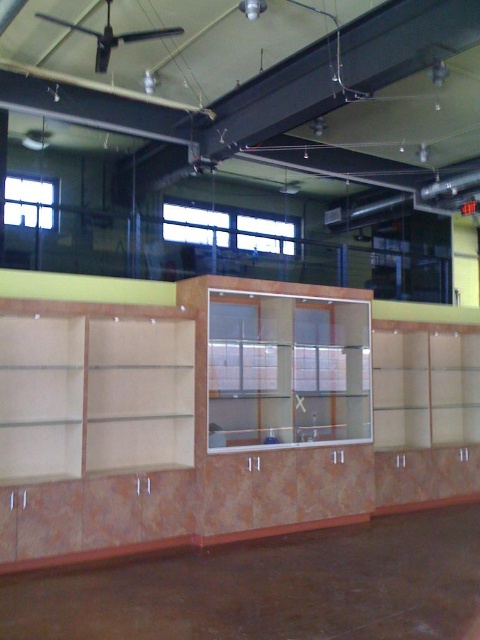
Is clear glass shelf at center bigger than matte wood shelf at center?

Yes.

Who is positioned more to the left, clear glass shelf at center or matte wood shelf at center?

clear glass shelf at center

Which is in front, point (339, 328) or point (440, 332)?

Point (339, 328)

Find the location of a particular element. clear glass shelf at center is located at coordinates (283, 362).

Who is shorter, light brown marble bookshelf at center or matte wood shelf at center?

light brown marble bookshelf at center

Does light brown marble bookshelf at center appear on the right side of matte wood shelf at center?

No, light brown marble bookshelf at center is not to the right of matte wood shelf at center.

Is point (131, 365) positioned after point (417, 388)?

No, it is not.

In order to click on light brown marble bookshelf at center in this screenshot , I will do click(x=205, y=420).

Between light brown marble bookshelf at center and clear glass shelf at center, which one has more height?

Standing taller between the two is clear glass shelf at center.

Can you confirm if light brown marble bookshelf at center is wider than clear glass shelf at center?

No, light brown marble bookshelf at center is not wider than clear glass shelf at center.

I want to click on light brown marble bookshelf at center, so click(x=205, y=420).

This screenshot has height=640, width=480. Identify the location of light brown marble bookshelf at center. (205, 420).